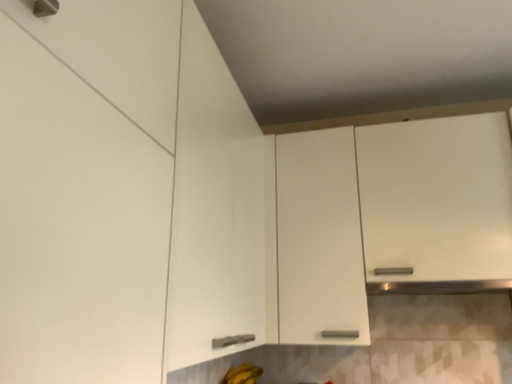
Question: Can you confirm if white matte cabinet at upper right, placed as the 1th cabinetry when sorted from right to left, is bigger than yellow matte bananas at lower center?

Choices:
 (A) no
 (B) yes

Answer: (B)

Question: Would you say white matte cabinet at upper right, placed as the 1th cabinetry when sorted from right to left, is outside yellow matte bananas at lower center?

Choices:
 (A) yes
 (B) no

Answer: (A)

Question: Are white matte cabinet at upper right, placed as the 1th cabinetry when sorted from right to left, and yellow matte bananas at lower center located far from each other?

Choices:
 (A) yes
 (B) no

Answer: (B)

Question: Is white matte cabinet at upper right, placed as the 1th cabinetry when sorted from right to left, at the right side of yellow matte bananas at lower center?

Choices:
 (A) no
 (B) yes

Answer: (B)

Question: Is white matte cabinet at upper right, acting as the 2th cabinetry starting from the left, at the left side of yellow matte bananas at lower center?

Choices:
 (A) no
 (B) yes

Answer: (A)

Question: From the image's perspective, is white matte cabinet at lower left, the second cabinetry in the right-to-left sequence, located above or below white matte cabinet at upper right, acting as the 2th cabinetry starting from the left?

Choices:
 (A) above
 (B) below

Answer: (A)

Question: Is point (7, 216) closer or farther from the camera than point (312, 228)?

Choices:
 (A) closer
 (B) farther

Answer: (A)

Question: Is white matte cabinet at lower left, the second cabinetry in the right-to-left sequence, taller or shorter than white matte cabinet at upper right, placed as the 1th cabinetry when sorted from right to left?

Choices:
 (A) tall
 (B) short

Answer: (B)

Question: In terms of size, does white matte cabinet at lower left, the second cabinetry in the right-to-left sequence, appear bigger or smaller than white matte cabinet at upper right, acting as the 2th cabinetry starting from the left?

Choices:
 (A) big
 (B) small

Answer: (B)

Question: Choose the correct answer: Is white matte cabinet at lower left, the second cabinetry in the right-to-left sequence, inside yellow matte bananas at lower center or outside it?

Choices:
 (A) inside
 (B) outside

Answer: (B)

Question: Visually, is white matte cabinet at lower left, the second cabinetry in the right-to-left sequence, positioned to the left or to the right of yellow matte bananas at lower center?

Choices:
 (A) left
 (B) right

Answer: (A)

Question: Considering the positions of white matte cabinet at lower left, the second cabinetry in the right-to-left sequence, and yellow matte bananas at lower center in the image, is white matte cabinet at lower left, the second cabinetry in the right-to-left sequence, wider or thinner than yellow matte bananas at lower center?

Choices:
 (A) wide
 (B) thin

Answer: (A)

Question: In the image, is white matte cabinet at lower left, the 1th cabinetry when ordered from left to right, positioned in front of or behind yellow matte bananas at lower center?

Choices:
 (A) behind
 (B) front

Answer: (B)

Question: Relative to white matte cabinet at lower left, the second cabinetry in the right-to-left sequence, is yellow matte bananas at lower center in front or behind?

Choices:
 (A) front
 (B) behind

Answer: (B)

Question: Considering the relative positions of yellow matte bananas at lower center and white matte cabinet at lower left, the second cabinetry in the right-to-left sequence, in the image provided, is yellow matte bananas at lower center to the left or to the right of white matte cabinet at lower left, the second cabinetry in the right-to-left sequence,?

Choices:
 (A) left
 (B) right

Answer: (B)